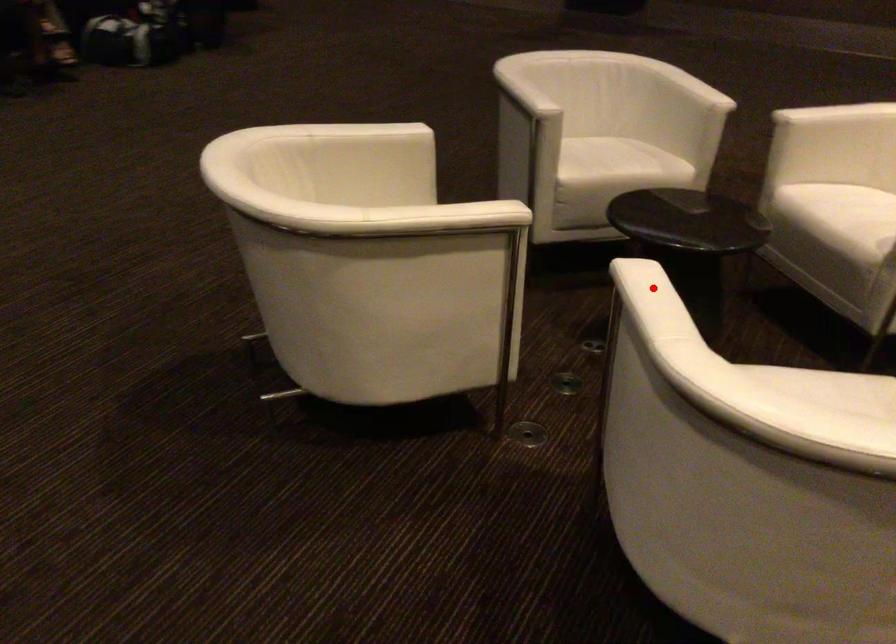
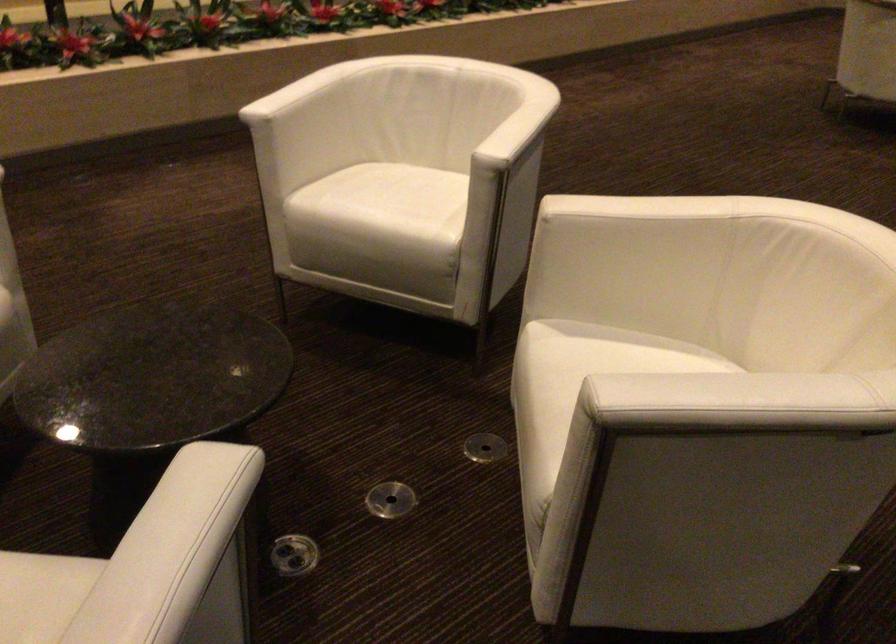
Question: I am providing you with two images of the same scene from different viewpoints. A red point is shown in image1. For the corresponding object point in image2, is it positioned nearer or farther from the camera?

Choices:
 (A) Nearer
 (B) Farther

Answer: (B)